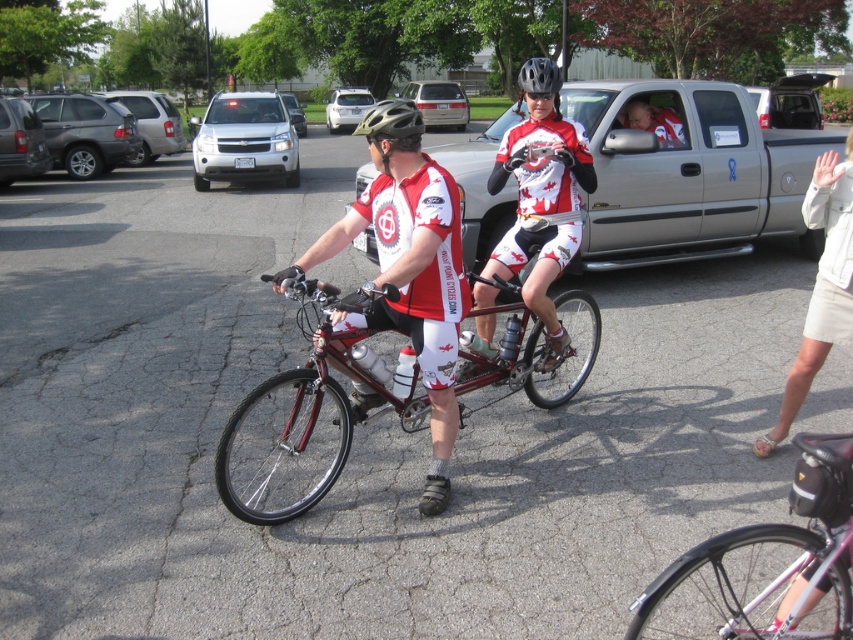
Question: Estimate the real-world distances between objects in this image. Which object is farther from the pink matte bicycle at lower right?

Choices:
 (A) matte red bicycle at center
 (B) white matte sedan at upper center
 (C) matte silver suv at left

Answer: (B)

Question: Does pink matte bicycle at lower right have a smaller size compared to silver metallic suv at upper left?

Choices:
 (A) no
 (B) yes

Answer: (B)

Question: Can you confirm if silver metallic truck at center is positioned to the left of beige fabric skirt at lower right?

Choices:
 (A) no
 (B) yes

Answer: (A)

Question: Which object is the farthest from the pink matte bicycle at lower right?

Choices:
 (A) shiny red bicycle at center
 (B) beige fabric skirt at lower right
 (C) silver metallic suv at center

Answer: (C)

Question: Is the position of silver metallic truck at center less distant than that of silver metallic suv at center?

Choices:
 (A) no
 (B) yes

Answer: (B)

Question: Which point appears closest to the camera in this image?

Choices:
 (A) (196, 122)
 (B) (650, 161)

Answer: (B)